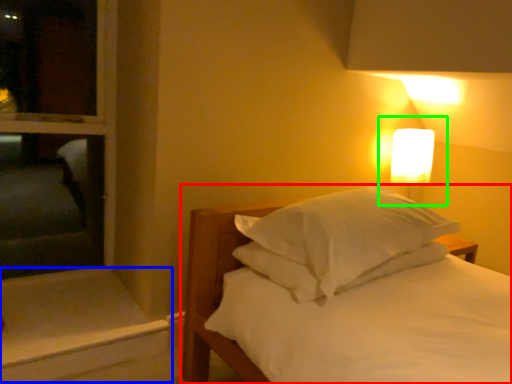
Question: Based on their relative distances, which object is farther from bed (highlighted by a red box)? Choose from window sill (highlighted by a blue box) and bedside lamp (highlighted by a green box).

Choices:
 (A) window sill
 (B) bedside lamp

Answer: (B)